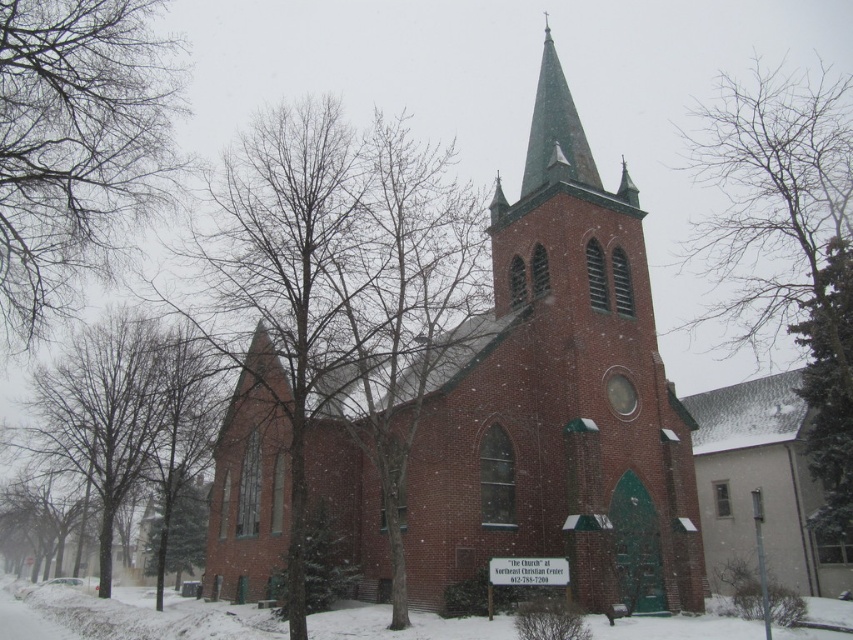
Who is higher up, brick church at center or brown leafless tree at left?

Positioned higher is brick church at center.

You are a GUI agent. You are given a task and a screenshot of the screen. Output one action in this format:
    pyautogui.click(x=<x>, y=<y>)
    Task: Click on the brick church at center
    
    Given the screenshot: What is the action you would take?
    pyautogui.click(x=555, y=397)

I want to click on brick church at center, so click(555, 397).

Who is more distant from viewer, (344, 384) or (819, 221)?

Point (819, 221)

Does bare branches at center appear on the left side of bare branches at upper center?

Indeed, bare branches at center is positioned on the left side of bare branches at upper center.

What do you see at coordinates (338, 291) in the screenshot? The width and height of the screenshot is (853, 640). I see `bare branches at center` at bounding box center [338, 291].

The image size is (853, 640). Identify the location of bare branches at center. (x=338, y=291).

Between bare branches at upper center and green textured evergreen tree at right, which one has less height?

With less height is green textured evergreen tree at right.

Can you confirm if bare branches at upper center is positioned above green textured evergreen tree at right?

Indeed, bare branches at upper center is positioned over green textured evergreen tree at right.

Between point (728, 84) and point (811, 316), which one is positioned behind?

The point (728, 84) is more distant.

Where is `bare branches at upper center`? bare branches at upper center is located at coordinates (786, 244).